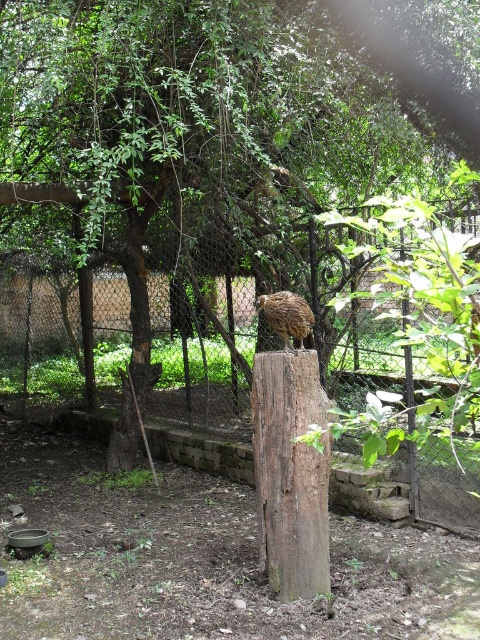
Is metal mesh fence at center closer to the viewer compared to brown feathered bird at center?

No, it is behind brown feathered bird at center.

Which is above, metal mesh fence at center or brown feathered bird at center?

brown feathered bird at center is higher up.

Where is `metal mesh fence at center`? metal mesh fence at center is located at coordinates (411, 497).

This screenshot has width=480, height=640. Identify the location of brown rough wood post at center. 290,474.

How distant is brown rough wood post at center from metal mesh fence at center?

brown rough wood post at center is 1.18 meters from metal mesh fence at center.

Locate an element on the screen. This screenshot has height=640, width=480. brown rough wood post at center is located at coordinates (290, 474).

Can you confirm if brown rough wood post at center is smaller than brown feathered bird at center?

No, brown rough wood post at center is not smaller than brown feathered bird at center.

Can you confirm if brown rough wood post at center is shorter than brown feathered bird at center?

Incorrect, brown rough wood post at center's height does not fall short of brown feathered bird at center's.

In order to click on brown rough wood post at center in this screenshot , I will do `click(290, 474)`.